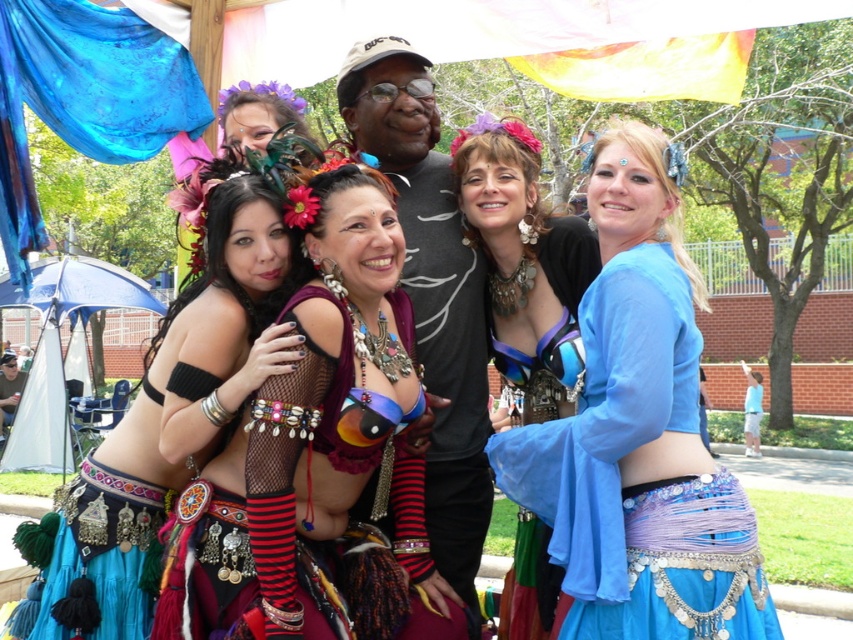
Question: Does shiny metallic belly dancer at center appear on the left side of shiny blue fabric at center?

Choices:
 (A) no
 (B) yes

Answer: (B)

Question: Does shiny metallic belly dancer at center have a greater width compared to matte black bikini top at center?

Choices:
 (A) yes
 (B) no

Answer: (A)

Question: Which point is closer to the camera?

Choices:
 (A) matte black bikini top at center
 (B) shiny blue fabric at center
 (C) shiny metallic belly dancer at center

Answer: (C)

Question: Which object is the farthest from the matte black bikini top at center?

Choices:
 (A) shiny metallic belly dancer at center
 (B) blue fabric belly dancer at right

Answer: (B)

Question: Does blue fabric belly dancer at right lie in front of shiny blue fabric at center?

Choices:
 (A) yes
 (B) no

Answer: (A)

Question: Which object is the farthest from the matte black bikini top at center?

Choices:
 (A) blue fabric belly dancer at right
 (B) shiny metallic belly dancer at center
 (C) shiny blue fabric at center

Answer: (C)